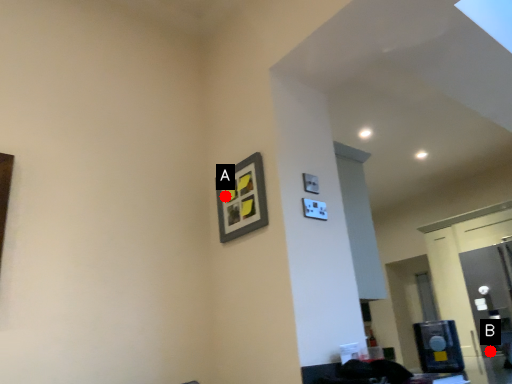
Question: Two points are circled on the image, labeled by A and B beside each circle. Among these points, which one is nearest to the camera?

Choices:
 (A) A is closer
 (B) B is closer

Answer: (A)